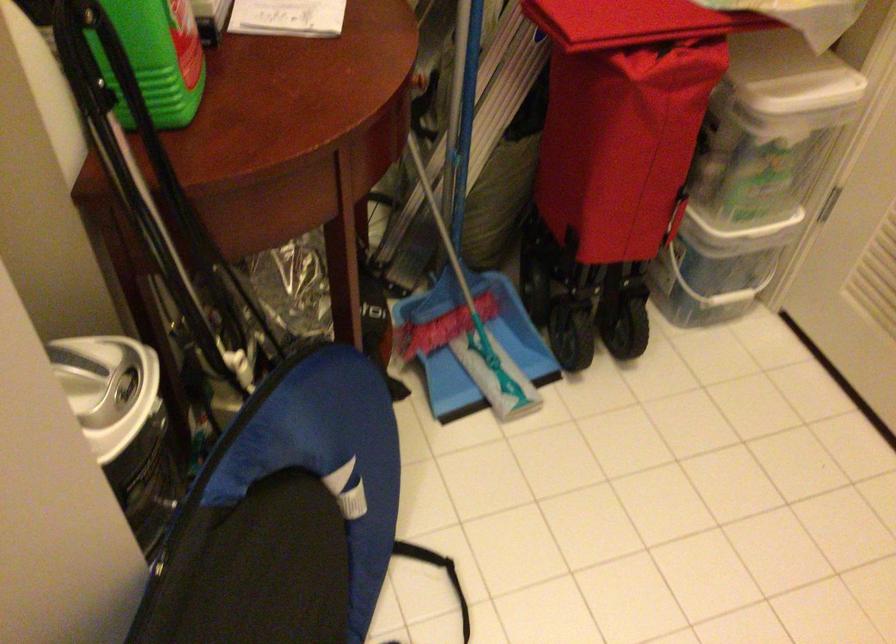
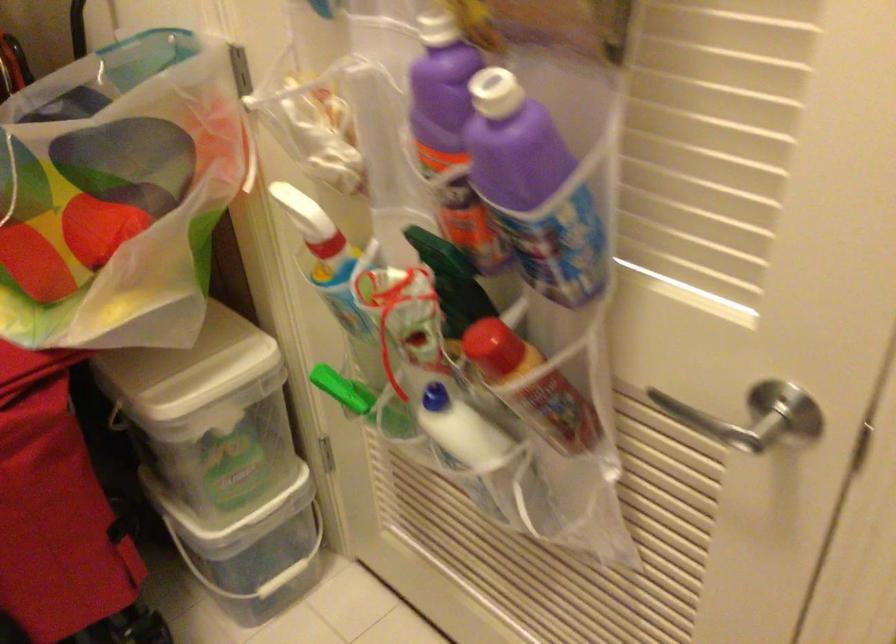
Question: The images are taken continuously from a first-person perspective. In which direction are you moving?

Choices:
 (A) Left
 (B) Right
 (C) Forward
 (D) Backward

Answer: (B)